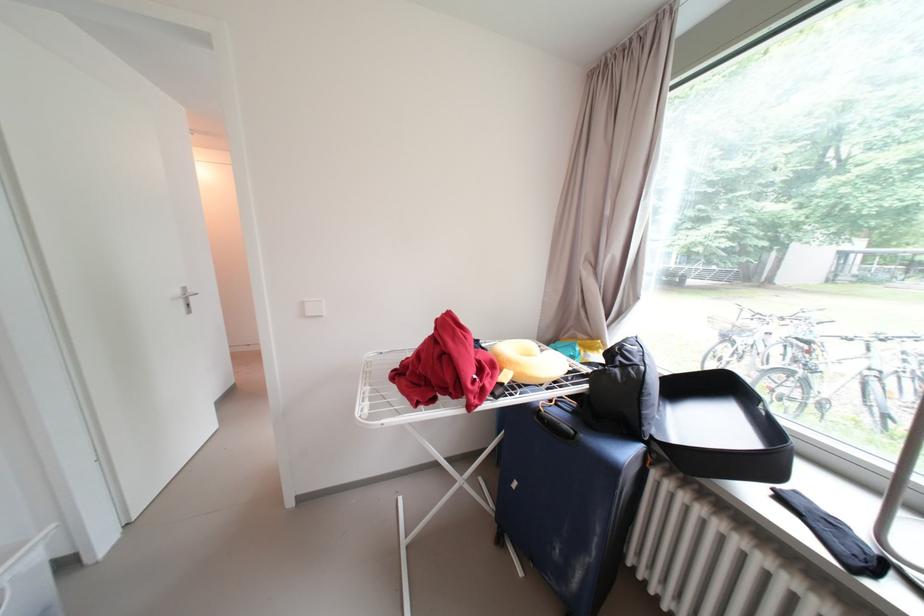
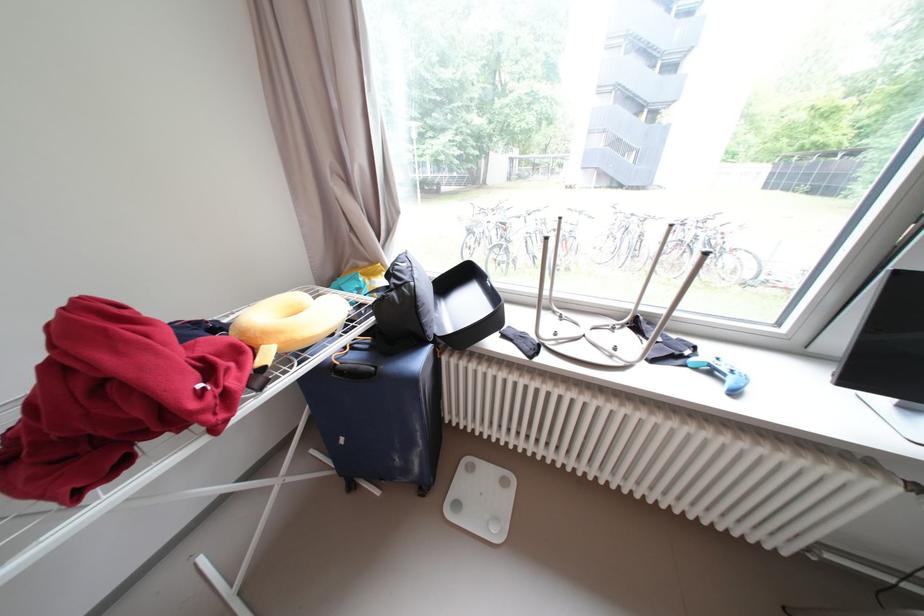
Locate, in the second image, the point that corresponds to pixel 549 411 in the first image.

(344, 366)